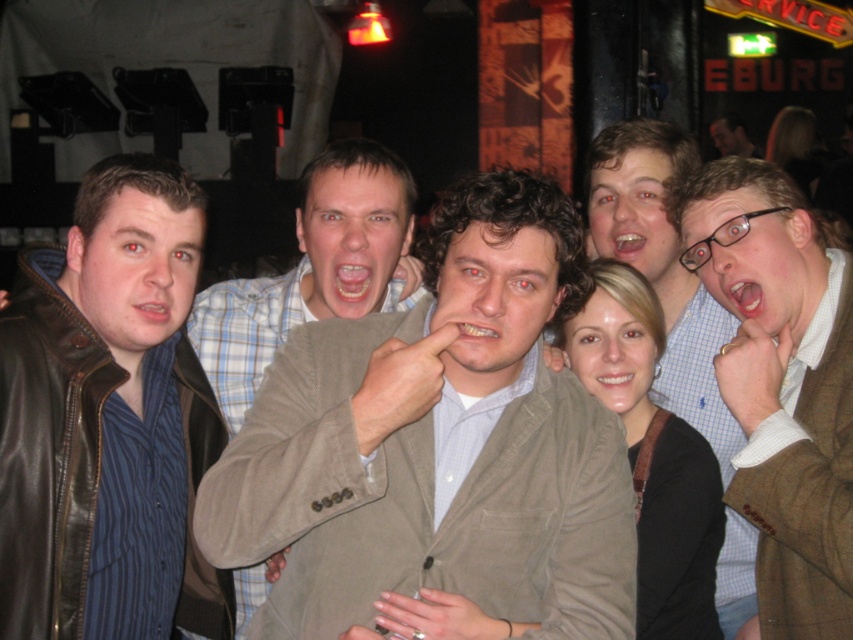
You are a photographer trying to capture a clear shot of both the leather jacket at left and the brown textured blazer at upper right. Since you want both to be visible, which one should you focus on first to ensure the larger item is in frame?

The leather jacket at left is bigger than the brown textured blazer at upper right, so you should focus on the leather jacket at left first to ensure it fits within the frame before adjusting for the smaller blazer.

Based on the scene description, where is the light brown textured blazer at center located in terms of its 2D coordinates?

The light brown textured blazer at center is located at the 2D coordinates point (440, 452).

You are a fashion designer analyzing the image. You need to determine which blazer is more suitable for a client who prefers a more oversized style. Based on the scene, which blazer between the light brown textured blazer at center and the brown textured blazer at upper right would you recommend?

The light brown textured blazer at center has a larger size compared to the brown textured blazer at upper right, so it would be more suitable for a client preferring an oversized style.